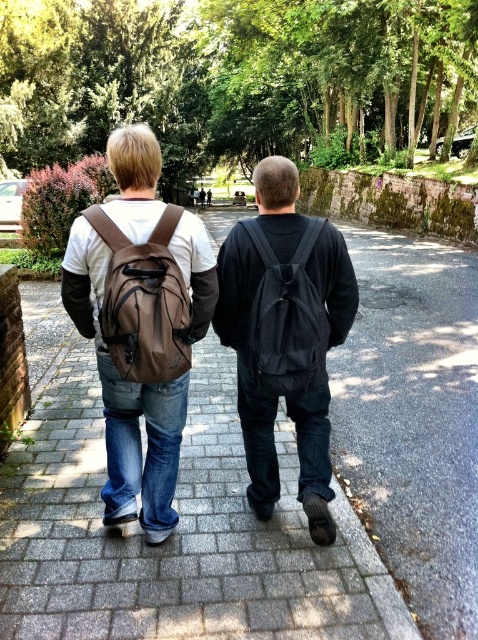
Question: Which object appears closest to the camera in this image?

Choices:
 (A) matte brown backpack at left
 (B) brown fabric backpack at left
 (C) dark blue jeans at center
 (D) matte black backpack at center

Answer: (B)

Question: Can you confirm if matte brown backpack at left is wider than black matte backpack at center?

Choices:
 (A) yes
 (B) no

Answer: (A)

Question: Can you confirm if matte black backpack at center is thinner than dark blue jeans at center?

Choices:
 (A) no
 (B) yes

Answer: (B)

Question: Does matte brown backpack at left have a smaller size compared to matte black backpack at center?

Choices:
 (A) yes
 (B) no

Answer: (B)

Question: Which point appears closest to the camera in this image?

Choices:
 (A) (164, 262)
 (B) (206, 196)
 (C) (276, 312)
 (D) (304, 380)

Answer: (A)

Question: Which of the following is the closest to the observer?

Choices:
 (A) matte black backpack at center
 (B) dark blue jeans at center
 (C) brown fabric backpack at left
 (D) matte brown backpack at left

Answer: (C)